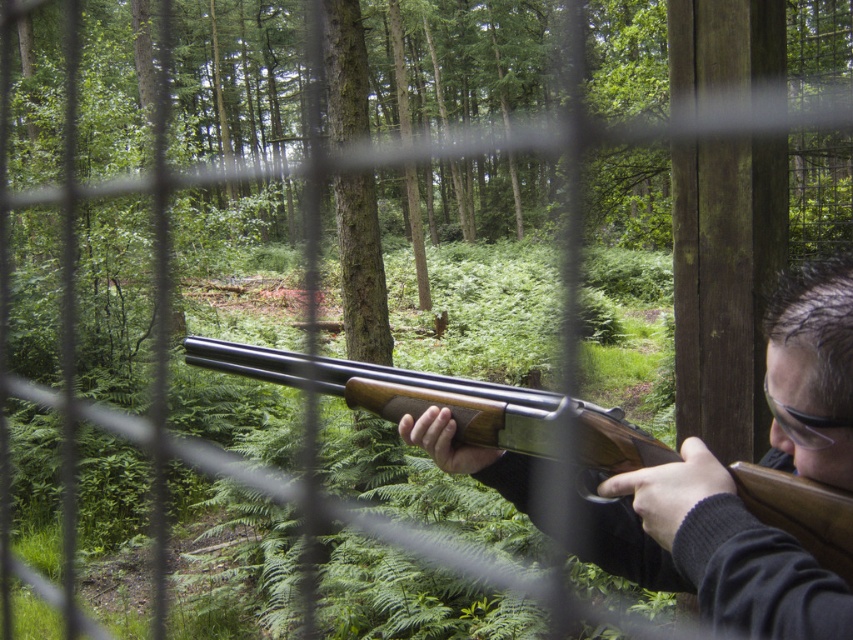
Based on the photo, who is higher up, wooden shotgun at center or clear plastic goggles at upper right?

clear plastic goggles at upper right

Does wooden shotgun at center have a larger size compared to clear plastic goggles at upper right?

Yes.

Is point (624, 499) less distant than point (786, 419)?

No, it is behind (786, 419).

The height and width of the screenshot is (640, 853). Find the location of `wooden shotgun at center`. wooden shotgun at center is located at coordinates (494, 413).